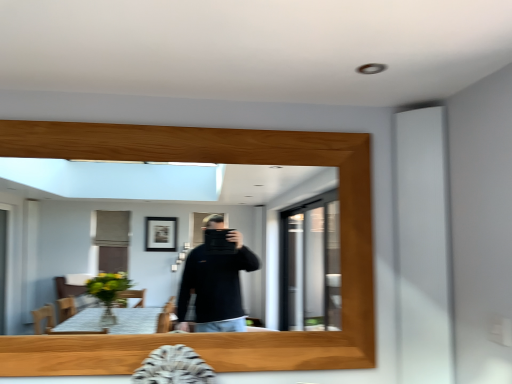
The width and height of the screenshot is (512, 384). What are the coordinates of `wooden mirror at center` in the screenshot? It's located at (140, 219).

What is the approximate height of wooden mirror at center?

The height of wooden mirror at center is 37.93 inches.

This screenshot has height=384, width=512. Describe the element at coordinates (140, 219) in the screenshot. I see `wooden mirror at center` at that location.

The width and height of the screenshot is (512, 384). In order to click on wooden mirror at center in this screenshot , I will do `click(140, 219)`.